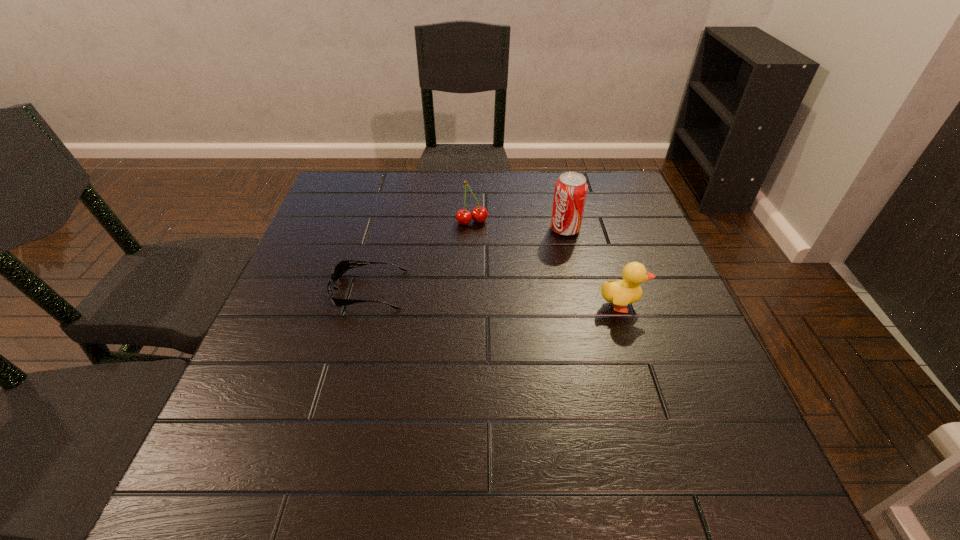
Locate which object is the third closest to the third object from right to left. Please provide its 2D coordinates. Your answer should be formatted as a tuple, i.e. [(x, y)], where the tuple contains the x and y coordinates of a point satisfying the conditions above.

[(620, 293)]

At what (x,y) coordinates should I click in order to perform the action: click on object identified as the third closest to the leftmost object. Please return your answer as a coordinate pair (x, y). This screenshot has width=960, height=540. Looking at the image, I should click on (620, 293).

The image size is (960, 540). I want to click on free region that satisfies the following two spatial constraints: 1. on the front side of the cherry; 2. on the front-facing side of the duckling, so click(x=470, y=305).

At what (x,y) coordinates should I click in order to perform the action: click on free point that satisfies the following two spatial constraints: 1. on the front side of the cherry; 2. on the front-facing side of the duckling. Please return your answer as a coordinate pair (x, y). The width and height of the screenshot is (960, 540). Looking at the image, I should click on (470, 305).